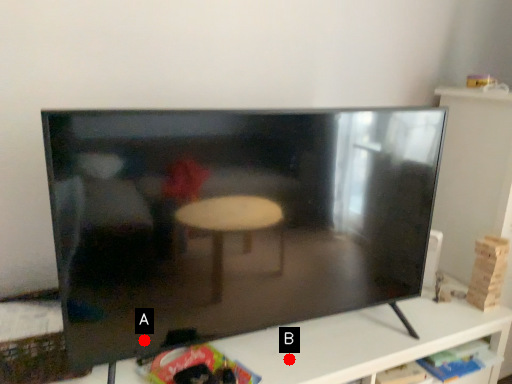
Question: Two points are circled on the image, labeled by A and B beside each circle. Which of the following is the farthest from the observer?

Choices:
 (A) A is further
 (B) B is further

Answer: (B)